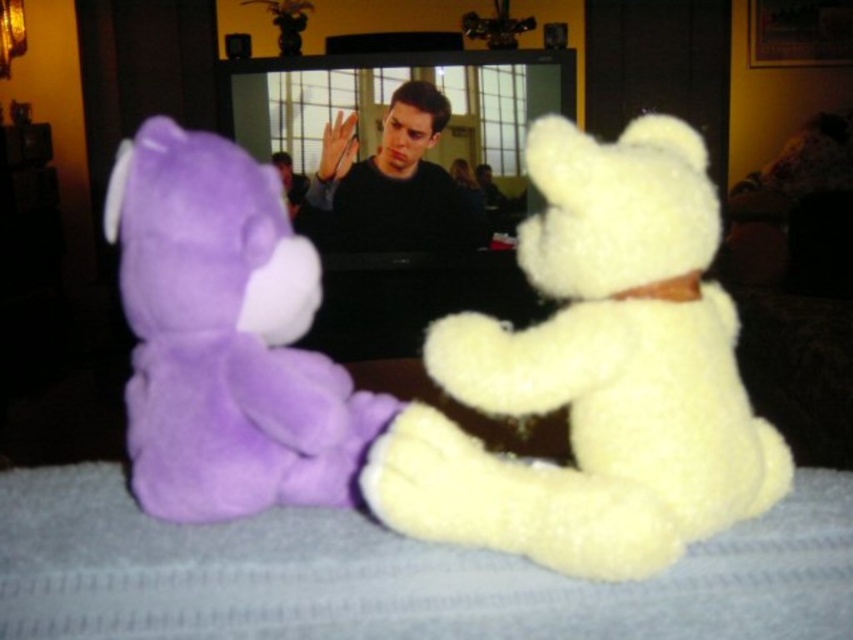
Is point (386, 502) more distant than point (302, 188)?

No, it is in front of (302, 188).

What do you see at coordinates (595, 374) in the screenshot? I see `white fluffy teddy bear at center` at bounding box center [595, 374].

You are a GUI agent. You are given a task and a screenshot of the screen. Output one action in this format:
    pyautogui.click(x=<x>, y=<y>)
    Task: Click on the white fluffy teddy bear at center
    This screenshot has height=640, width=853.
    Given the screenshot: What is the action you would take?
    pyautogui.click(x=595, y=374)

Where is `white fluffy teddy bear at center`? The image size is (853, 640). white fluffy teddy bear at center is located at coordinates (595, 374).

Can you confirm if purple plush bear at left is smaller than matte black sweater at center?

Indeed, purple plush bear at left has a smaller size compared to matte black sweater at center.

Identify the location of purple plush bear at left. (225, 337).

Who is taller, matte black sweater at center or matte black shirt at center?

With more height is matte black sweater at center.

Does matte black sweater at center appear on the right side of matte black shirt at center?

Correct, you'll find matte black sweater at center to the right of matte black shirt at center.

Locate an element on the screen. matte black sweater at center is located at coordinates (393, 182).